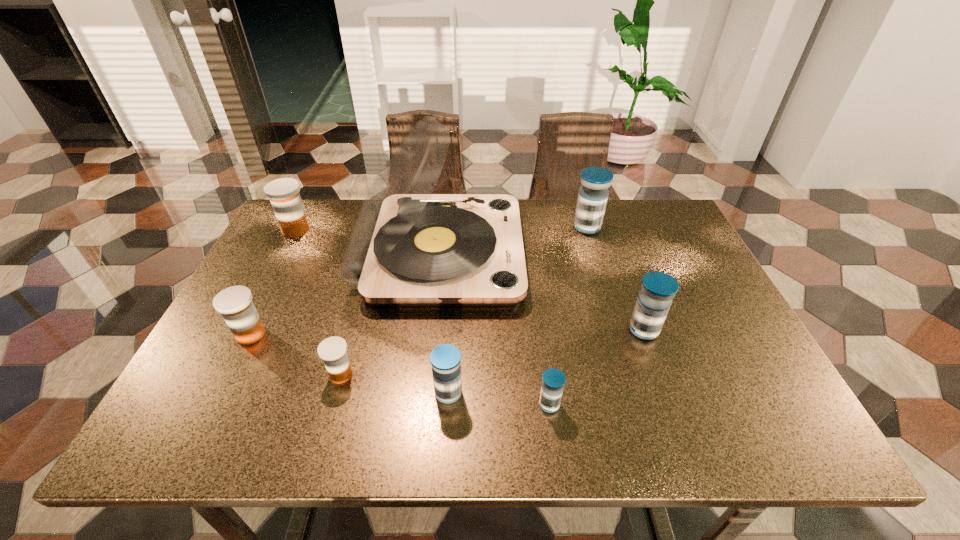
Where is `vacant space in between the third smallest blue medicine and the second smallest blue medicine`? The image size is (960, 540). vacant space in between the third smallest blue medicine and the second smallest blue medicine is located at coordinates (546, 361).

Where is `empty location between the biggest orange medicine and the smallest orange medicine`? Image resolution: width=960 pixels, height=540 pixels. empty location between the biggest orange medicine and the smallest orange medicine is located at coordinates (319, 302).

The image size is (960, 540). I want to click on free space that is in between the farthest orange medicine and the fourth medicine from right to left, so click(x=372, y=312).

Locate an element on the screen. The width and height of the screenshot is (960, 540). empty space between the second farthest orange medicine and the second farthest blue medicine is located at coordinates (447, 332).

Identify the location of vacant area that lies between the fifth medicine from right to left and the third nearest blue medicine. Image resolution: width=960 pixels, height=540 pixels. (492, 352).

Locate an element on the screen. The image size is (960, 540). the seventh closest object to the second nearest orange medicine is located at coordinates (593, 194).

Point out which object is positioned as the fifth nearest to the third medicine from right to left. Please provide its 2D coordinates. Your answer should be formatted as a tuple, i.e. [(x, y)], where the tuple contains the x and y coordinates of a point satisfying the conditions above.

[(593, 194)]

This screenshot has height=540, width=960. Find the location of `medicine that is the closest one to the third object from right to left`. medicine that is the closest one to the third object from right to left is located at coordinates (445, 359).

Locate an element on the screen. The image size is (960, 540). medicine that is the second closest to the biggest orange medicine is located at coordinates (333, 351).

Locate an element on the screen. the third closest blue medicine relative to the biggest blue medicine is located at coordinates (445, 359).